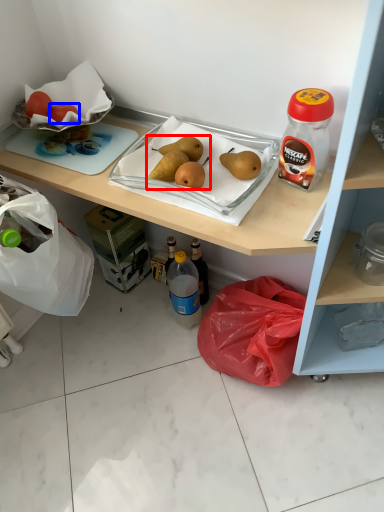
Question: Which of the following is the farthest to the observer, food (highlighted by a red box) or fruit (highlighted by a blue box)?

Choices:
 (A) food
 (B) fruit

Answer: (B)